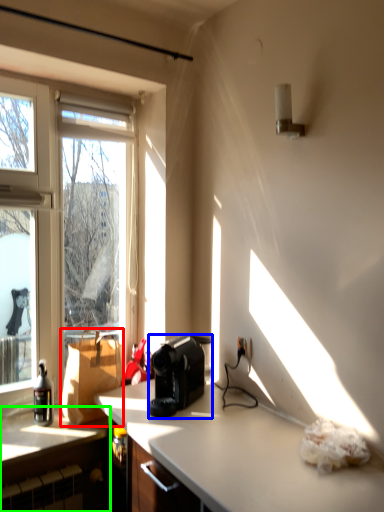
Question: Based on their relative distances, which object is nearer to cardboard box (highlighted by a red box)? Choose from coffee maker (highlighted by a blue box) and cabinetry (highlighted by a green box).

Choices:
 (A) coffee maker
 (B) cabinetry

Answer: (B)